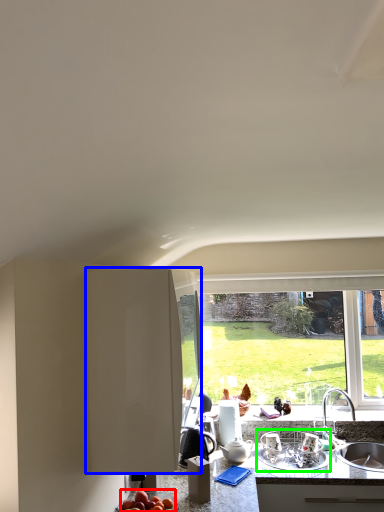
Question: Which object is positioned closest to apple (highlighted by a red box)? Select from cabinetry (highlighted by a blue box) and appliance (highlighted by a green box).

Choices:
 (A) cabinetry
 (B) appliance

Answer: (A)